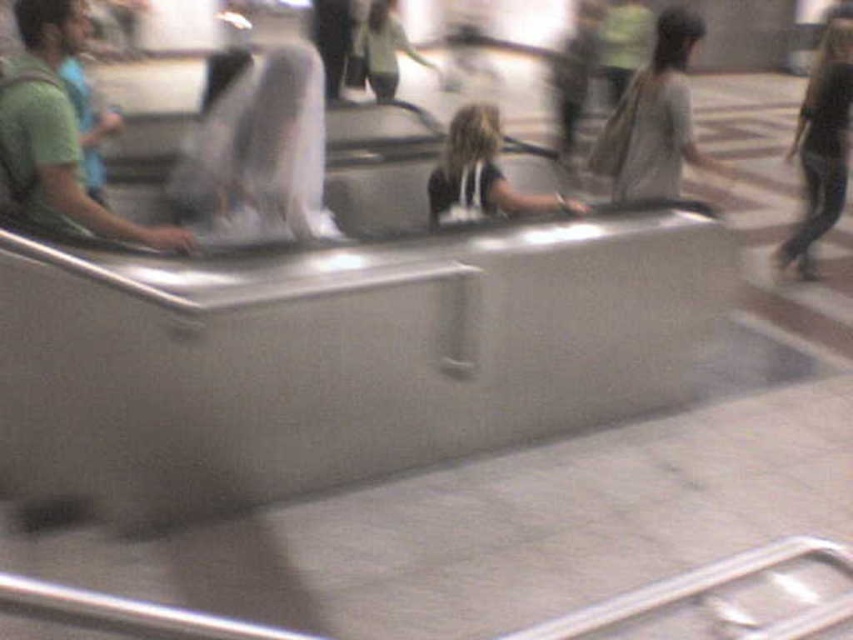
You are standing at the point labeled point (689, 28) in the airport baggage claim area. If you want to take a photo of the curved conveyor belt using a camera that has a maximum focus distance of 3.7 meters, will you be able to capture the conveyor belt clearly?

The distance between point (689, 28) and the camera is 3.72 meters. Since the camera can only focus up to 3.7 meters, you won t be able to capture the conveyor belt clearly because the distance exceeds the maximum focus range.